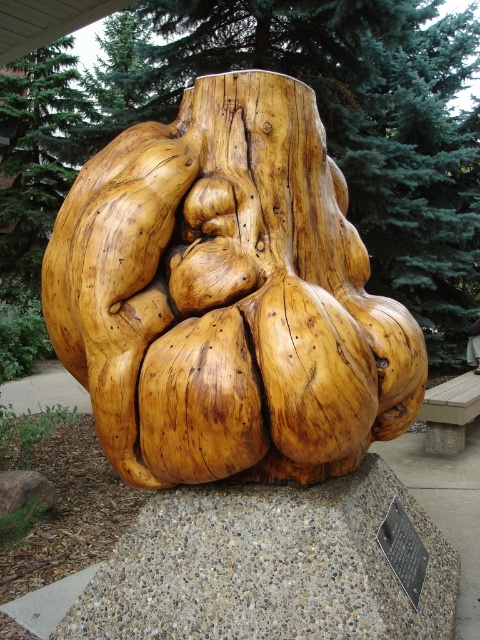
You are standing in front of the garlic sculpture and want to take a photo. The camera you have can focus on objects up to 3 meters away. Is the point at coordinates point (337,176) within the camera focus range?

The distance of point (337,176) from the camera is 2.86 meters, so yes, the point is within the camera focus range since it is closer than 3 meters.

You are a visitor sitting on the wooden bench at center. Looking up, you see the natural wood sculpture at center. Can you determine if the sculpture is positioned above or below the bench?

The natural wood sculpture at center is located above the wooden bench at center, so it is positioned above the bench.

You are a visitor at the park and want to sit on the wooden bench at center. Which side of the bench should you choose if you want to face the natural wood sculpture at center?

You should sit on the right side of the wooden bench at center because the natural wood sculpture at center is positioned to the left of the bench, so facing towards the left side would allow you to see the sculpture.